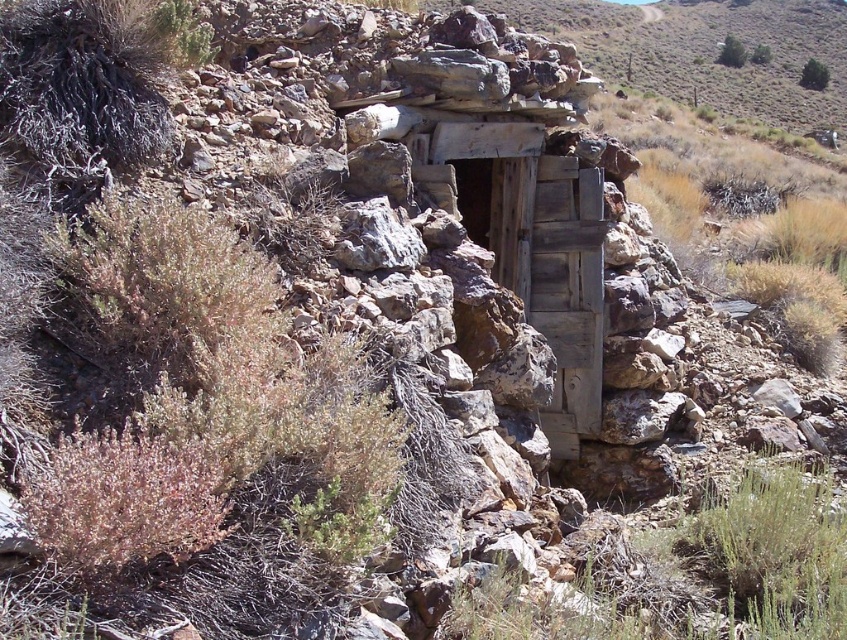
Does green leafy bush at upper right appear under green leafy shrub at upper center?

Indeed, green leafy bush at upper right is positioned under green leafy shrub at upper center.

Is point (811, 64) positioned after point (756, 52)?

No, it is not.

Measure the distance between point (809, 76) and camera.

76.51 meters

Find the location of a particular element. This screenshot has height=640, width=847. green leafy bush at upper right is located at coordinates (814, 74).

Is point (823, 72) farther from viewer compared to point (721, 60)?

No, it is not.

Find the location of `green leafy bush at upper right`. green leafy bush at upper right is located at coordinates (814, 74).

From the picture: How much distance is there between green leafy shrub at upper right and green leafy shrub at upper center?

green leafy shrub at upper right is 3.23 meters away from green leafy shrub at upper center.

Can you confirm if green leafy shrub at upper right is smaller than green leafy shrub at upper center?

Incorrect, green leafy shrub at upper right is not smaller in size than green leafy shrub at upper center.

Who is more forward, (718, 51) or (770, 58)?

Point (770, 58)

Find the location of a particular element. The image size is (847, 640). green leafy shrub at upper right is located at coordinates (731, 51).